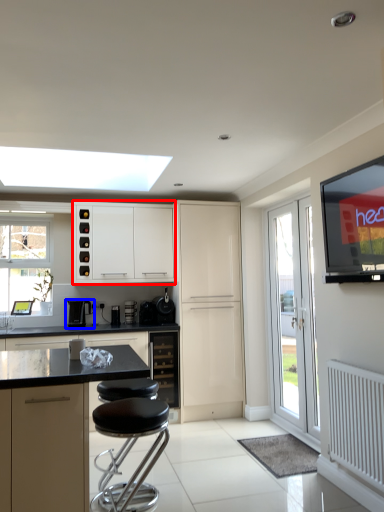
Question: Among these objects, which one is nearest to the camera, cabinetry (highlighted by a red box) or coffee machine (highlighted by a blue box)?

Choices:
 (A) cabinetry
 (B) coffee machine

Answer: (A)